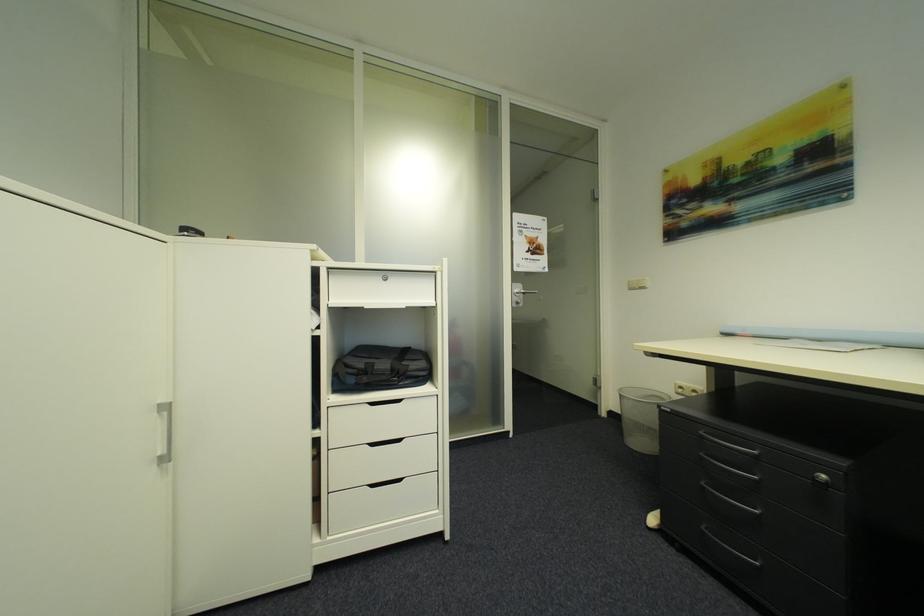
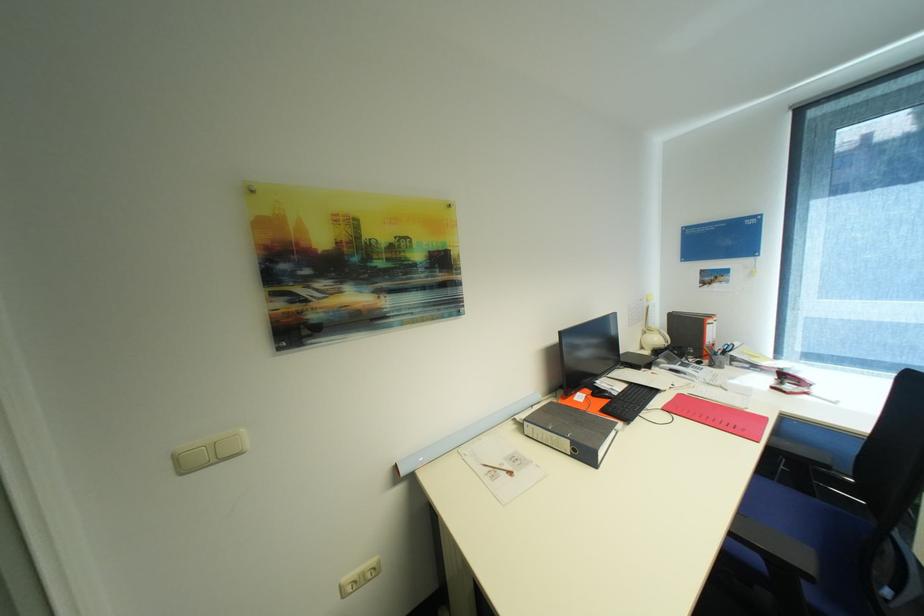
Locate, in the second image, the point that corresponds to the point at 684,385 in the first image.

(348, 586)